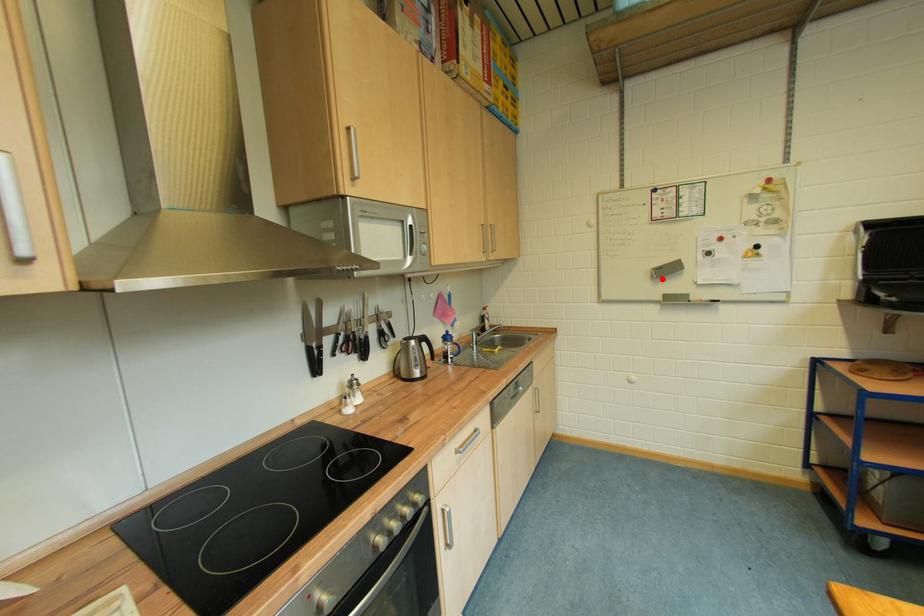
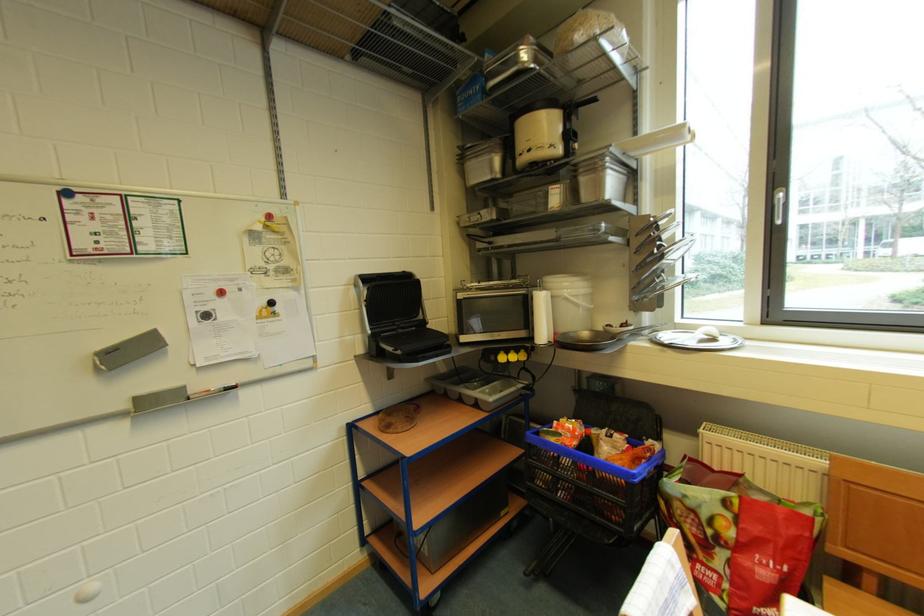
The point at the highlighted location is marked in the first image. Where is the corresponding point in the second image?

(110, 370)